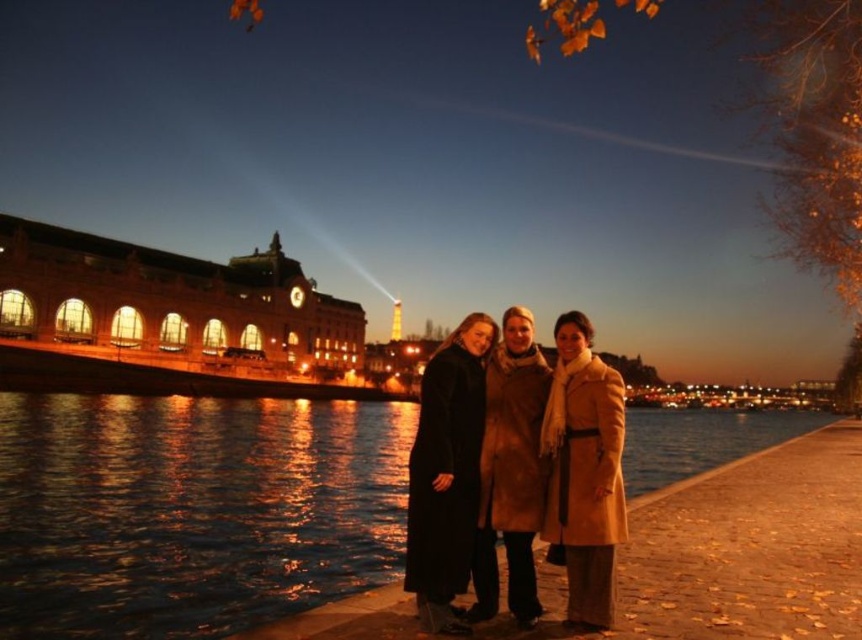
Is blue water at center positioned before matte brown coat at center?

No.

Between point (728, 458) and point (507, 353), which one is positioned behind?

The point (728, 458) is behind.

The width and height of the screenshot is (862, 640). I want to click on blue water at center, so click(191, 512).

Which is above, blue water at center or beige wool coat at center?

beige wool coat at center is above.

Can you confirm if blue water at center is positioned to the right of beige wool coat at center?

Yes, blue water at center is to the right of beige wool coat at center.

Is point (322, 468) positioned after point (607, 605)?

Yes.

Find the location of `blue water at center`. blue water at center is located at coordinates (191, 512).

Which is below, matte brown coat at center or beige wool coat at center?

matte brown coat at center is lower down.

Who is more distant from viewer, [514,516] or [590,364]?

Positioned behind is point [590,364].

At what (x,y) coordinates should I click in order to perform the action: click on matte brown coat at center. Please return your answer as a coordinate pair (x, y). Looking at the image, I should click on (560, 474).